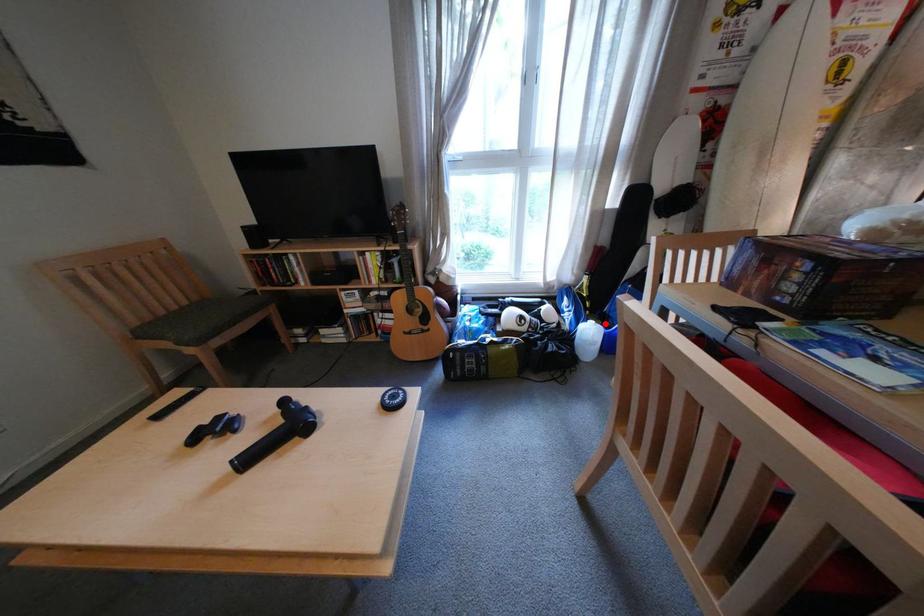
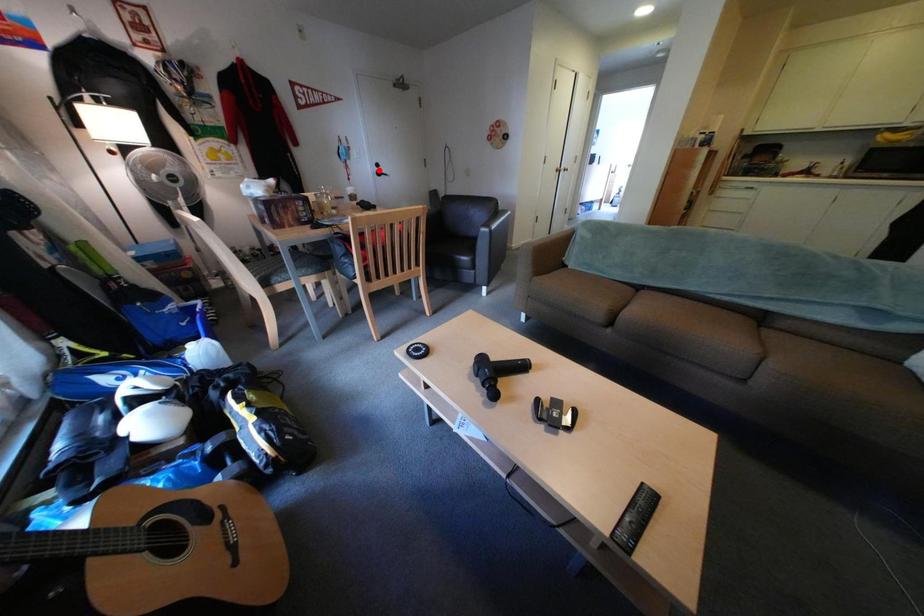
Looking at this image, I am providing you with two images of the same scene from different viewpoints. A red point is marked on the first image and another point is marked on the second image. Is the red point in image1 aligned with the point shown in image2?

No